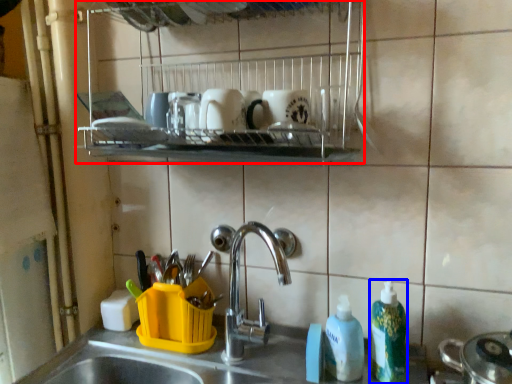
Question: Which of the following is the closest to the observer, shelf (highlighted by a red box) or cleaning product (highlighted by a blue box)?

Choices:
 (A) shelf
 (B) cleaning product

Answer: (A)